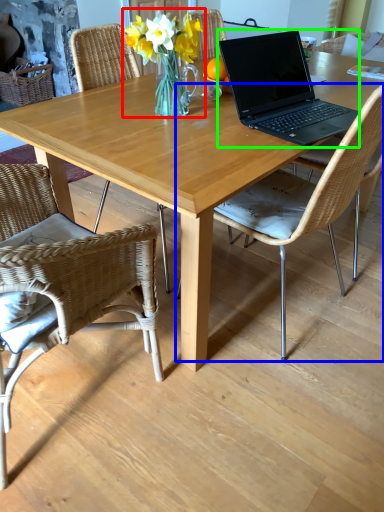
Question: Which is nearer to the floral arrangement (highlighted by a red box)? chair (highlighted by a blue box) or laptop (highlighted by a green box).

Choices:
 (A) chair
 (B) laptop

Answer: (B)